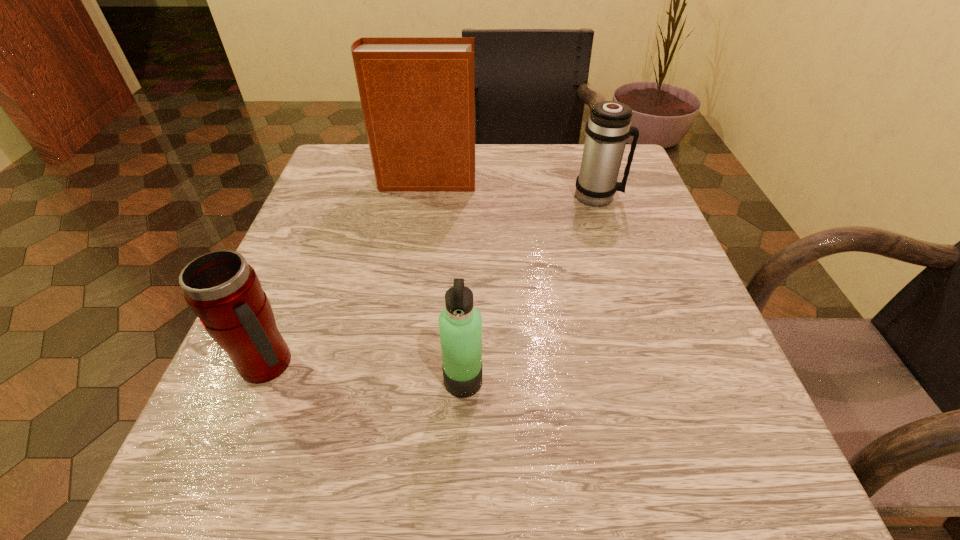
Find the location of a particular element. This screenshot has width=960, height=540. blank space at the far right corner of the desktop is located at coordinates (639, 184).

Find the location of `free spot between the leftmost object and the tallest object`. free spot between the leftmost object and the tallest object is located at coordinates (348, 273).

Identify the location of blank region between the leftmost object and the second thermos bottle from left to right. The image size is (960, 540). (366, 373).

You are a GUI agent. You are given a task and a screenshot of the screen. Output one action in this format:
    pyautogui.click(x=<x>, y=<y>)
    Task: Click on the empty space between the leftmost object and the second thermos bottle from right to left
    This screenshot has height=540, width=960.
    Given the screenshot: What is the action you would take?
    pyautogui.click(x=366, y=373)

Find the location of a particular element. This screenshot has width=960, height=540. blank region between the second thermos bottle from left to right and the tallest object is located at coordinates (444, 281).

The width and height of the screenshot is (960, 540). I want to click on free space between the hardback book and the leftmost thermos bottle, so click(x=348, y=273).

In order to click on unoccupied area between the farthest thermos bottle and the hardback book in this screenshot , I will do `click(512, 189)`.

The width and height of the screenshot is (960, 540). Identify the location of vacant area that lies between the second thermos bottle from left to right and the leftmost thermos bottle. (366, 373).

This screenshot has height=540, width=960. What are the coordinates of `vacant space that is in between the tallest object and the second thermos bottle from right to left` in the screenshot? It's located at (444, 281).

The height and width of the screenshot is (540, 960). I want to click on vacant space that is in between the hardback book and the second thermos bottle from right to left, so click(444, 281).